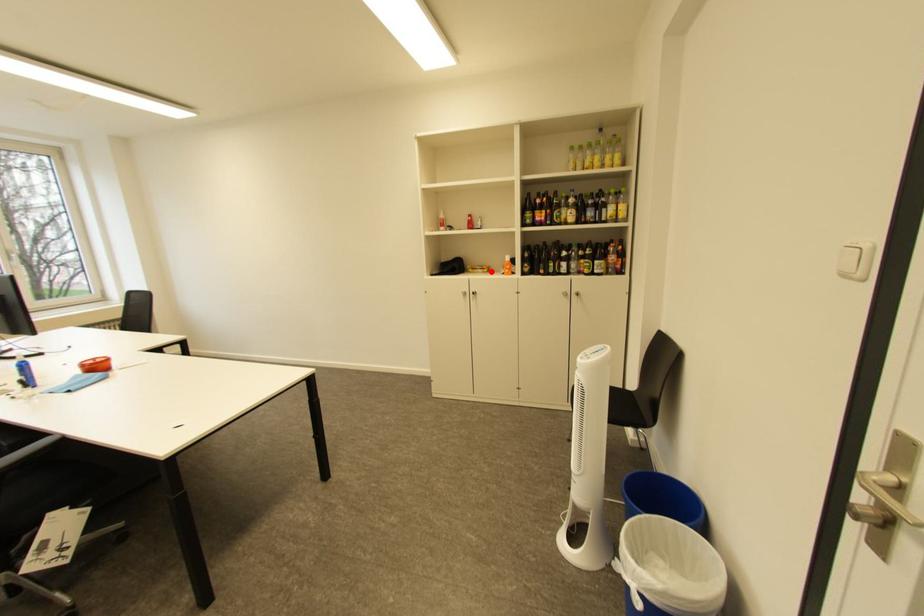
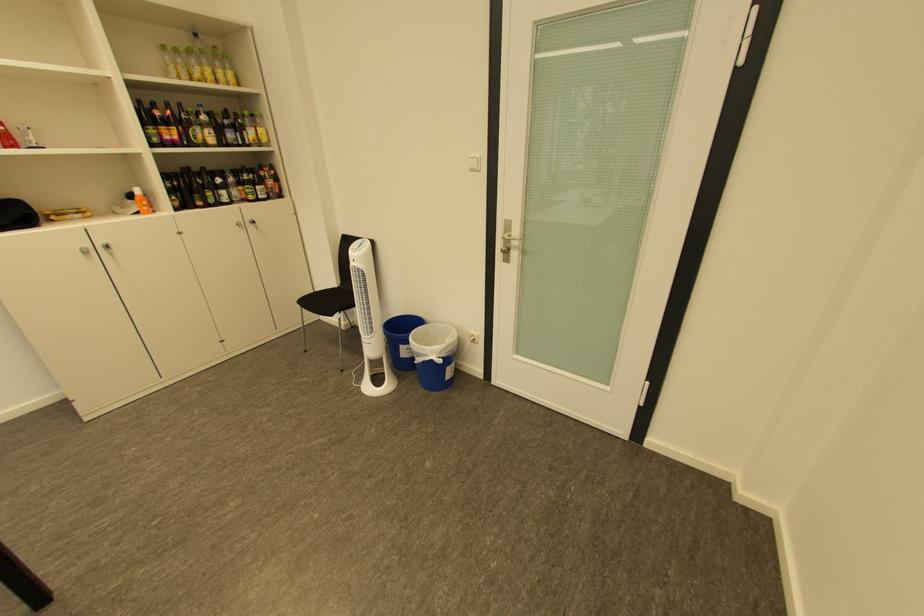
Question: I am providing you with two images of the same scene from different viewpoints. Image1 has a red point marked. In image2, the corresponding 3D location appears at what relative position? Reply with the corresponding letter.

Choices:
 (A) Closer
 (B) Farther

Answer: (B)